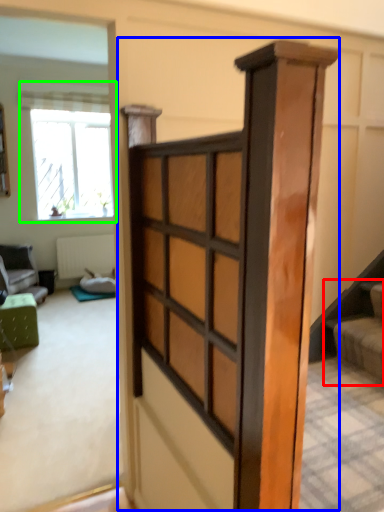
Question: Which is farther away from stairs (highlighted by a red box)? barn door (highlighted by a blue box) or window (highlighted by a green box)?

Choices:
 (A) barn door
 (B) window

Answer: (B)